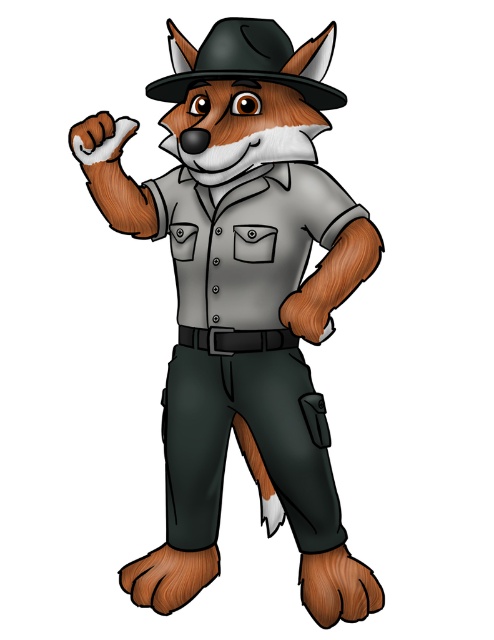
You are designing a costume for a play and need to ensure the gray matte uniform at center and the black matte fedora at upper center fit together. Which item is wider?

The gray matte uniform at center is wider than the black matte fedora at upper center, so it will fit together appropriately.